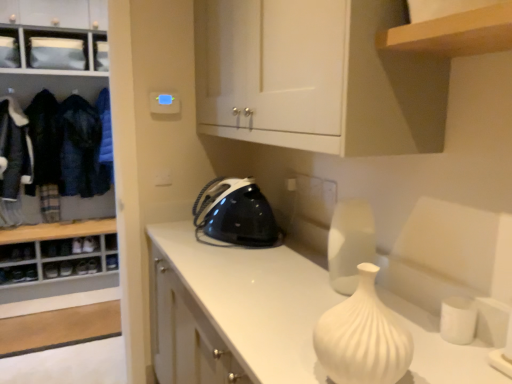
Question: Does white matte vase at center have a smaller size compared to denim jacket at left, arranged as the 3th clothing when viewed from the left?

Choices:
 (A) no
 (B) yes

Answer: (B)

Question: Can we say white matte vase at center lies outside denim jacket at left, which is the second clothing from right to left?

Choices:
 (A) yes
 (B) no

Answer: (A)

Question: From the image's perspective, is white matte vase at center located above denim jacket at left, which is the second clothing from right to left?

Choices:
 (A) yes
 (B) no

Answer: (B)

Question: Is white matte vase at center far away from denim jacket at left, which is the second clothing from right to left?

Choices:
 (A) no
 (B) yes

Answer: (B)

Question: From a real-world perspective, is white matte vase at center below denim jacket at left, arranged as the 3th clothing when viewed from the left?

Choices:
 (A) no
 (B) yes

Answer: (B)

Question: Is white matte vase at center behind denim jacket at left, which is the second clothing from right to left?

Choices:
 (A) yes
 (B) no

Answer: (B)

Question: From a real-world perspective, is white matte vase at center beneath dark blue woolen jacket at left, the third clothing when ordered from right to left?

Choices:
 (A) no
 (B) yes

Answer: (B)

Question: Considering the relative positions of white matte vase at center and dark blue woolen jacket at left, the third clothing when ordered from right to left, in the image provided, is white matte vase at center to the left of dark blue woolen jacket at left, the third clothing when ordered from right to left, from the viewer's perspective?

Choices:
 (A) no
 (B) yes

Answer: (A)

Question: Could dark blue woolen jacket at left, the third clothing when ordered from right to left, be considered to be inside white matte vase at center?

Choices:
 (A) yes
 (B) no

Answer: (B)

Question: Does white matte vase at center come in front of dark blue woolen jacket at left, the third clothing when ordered from right to left?

Choices:
 (A) yes
 (B) no

Answer: (A)

Question: Considering the relative positions of white matte vase at center and dark blue woolen jacket at left, the third clothing when ordered from right to left, in the image provided, is white matte vase at center behind dark blue woolen jacket at left, the third clothing when ordered from right to left,?

Choices:
 (A) yes
 (B) no

Answer: (B)

Question: Is white matte vase at center oriented towards dark blue woolen jacket at left, the third clothing when ordered from right to left?

Choices:
 (A) no
 (B) yes

Answer: (A)

Question: Does white matte cabinet at upper center, which appears as the 2th cabinetry when viewed from the left, have a smaller size compared to black glossy iron at center?

Choices:
 (A) no
 (B) yes

Answer: (A)